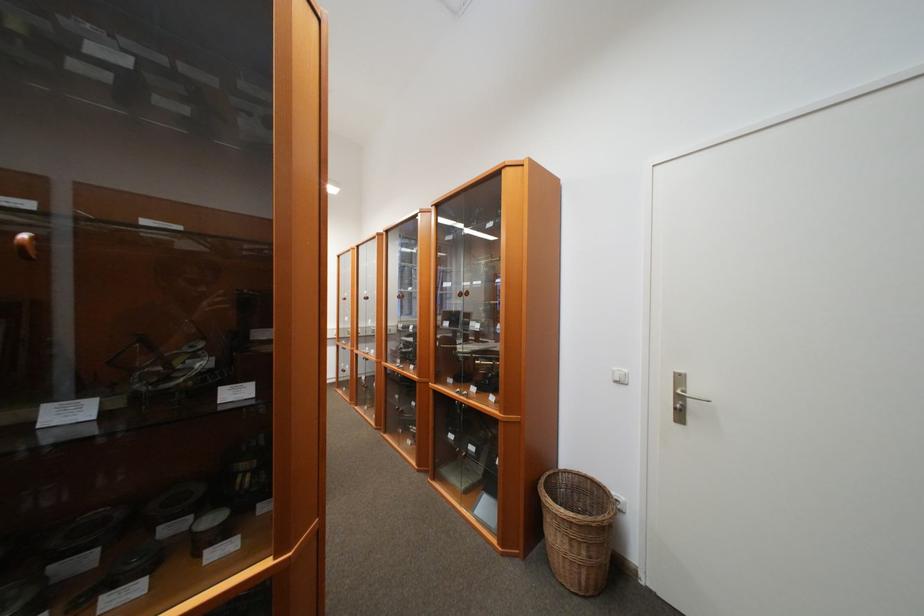
The height and width of the screenshot is (616, 924). What do you see at coordinates (619, 376) in the screenshot?
I see `the white light switch` at bounding box center [619, 376].